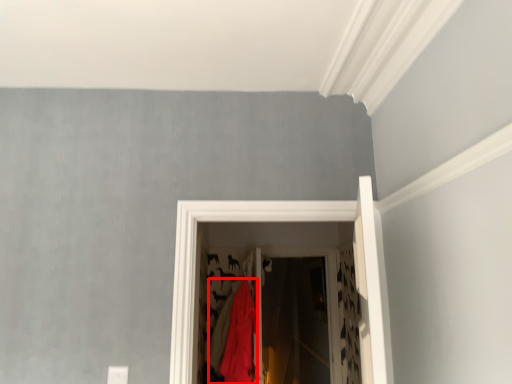
Question: From the image, what is the correct spatial relationship of clothing (annotated by the red box) in relation to screen door?

Choices:
 (A) left
 (B) right

Answer: (A)